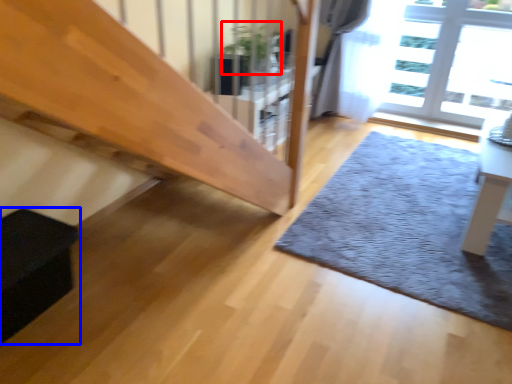
Question: Among these objects, which one is nearest to the camera, plant (highlighted by a red box) or furniture (highlighted by a blue box)?

Choices:
 (A) plant
 (B) furniture

Answer: (B)